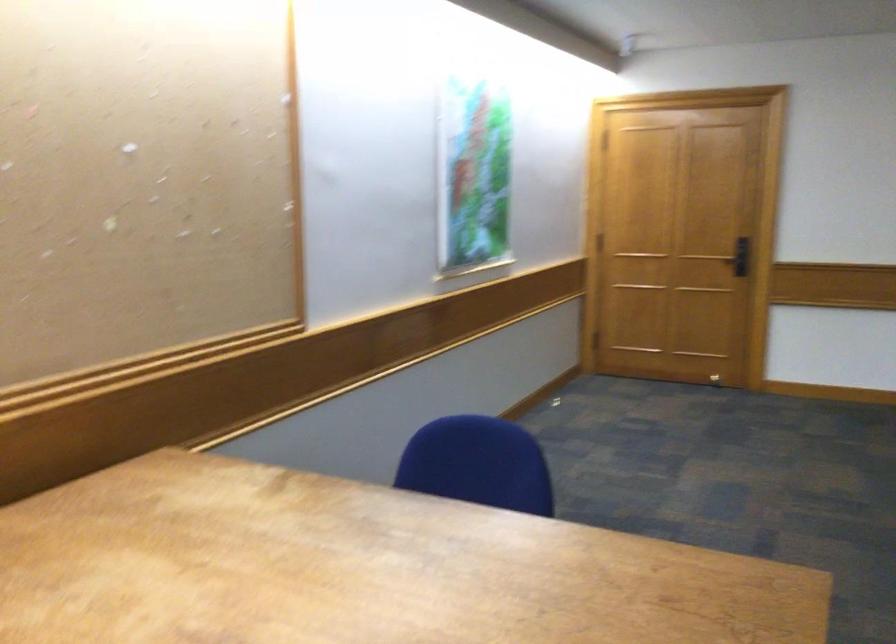
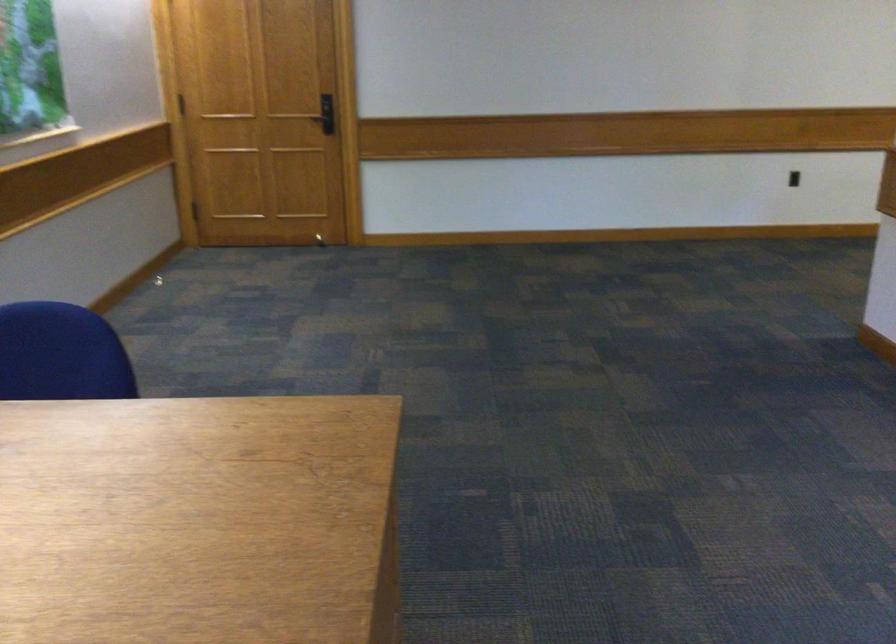
Locate, in the second image, the point that corresponds to (739,257) in the first image.

(331, 116)